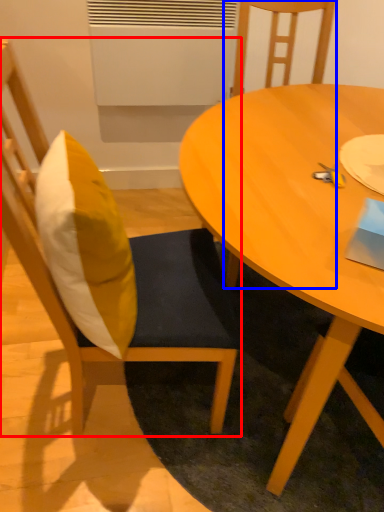
Question: Which object is further to the camera taking this photo, chair (highlighted by a red box) or chair (highlighted by a blue box)?

Choices:
 (A) chair
 (B) chair

Answer: (B)